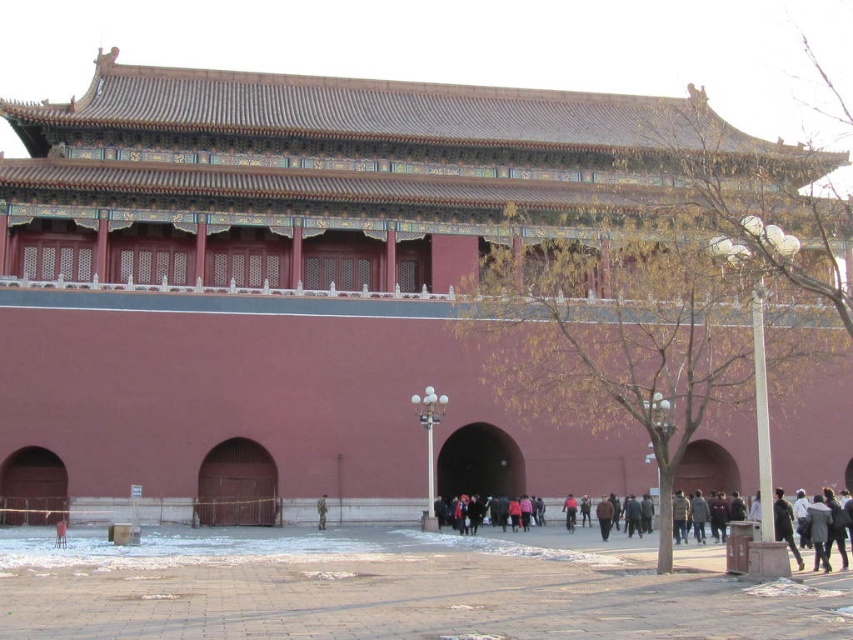
Does brick pavement at center appear over dark gray sweater at center?

No, brick pavement at center is not above dark gray sweater at center.

Is point (822, 602) in front of point (606, 536)?

That is True.

Is point (357, 576) more distant than point (788, 566)?

Yes, point (357, 576) is farther from viewer.

Locate an element on the screen. This screenshot has height=640, width=853. brick pavement at center is located at coordinates (381, 592).

In the scene shown: Is dark gray sweater at center to the right of camouflage uniform at center from the viewer's perspective?

Yes, dark gray sweater at center is to the right of camouflage uniform at center.

Is dark gray sweater at center taller than camouflage uniform at center?

Yes, dark gray sweater at center is taller than camouflage uniform at center.

Is point (737, 556) less distant than point (323, 506)?

Yes, point (737, 556) is closer to viewer.

The image size is (853, 640). Find the location of `dark gray sweater at center`. dark gray sweater at center is located at coordinates click(x=753, y=552).

Which is more to the left, brick pavement at center or camouflage uniform at center?

camouflage uniform at center

Is brick pavement at center positioned before camouflage uniform at center?

Yes, it is.

Measure the distance between point (271, 547) and camera.

The distance of point (271, 547) from camera is 42.05 meters.

Locate an element on the screen. The height and width of the screenshot is (640, 853). brick pavement at center is located at coordinates (381, 592).